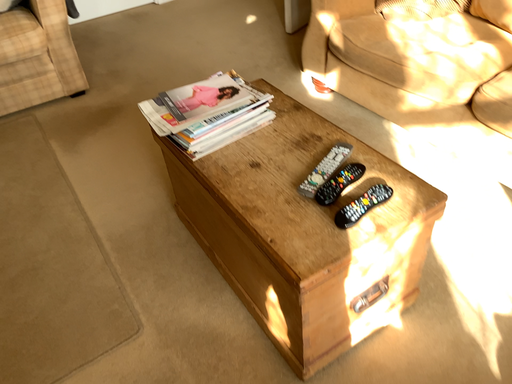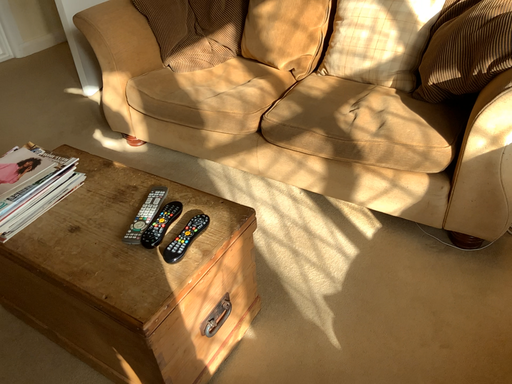
Question: Which way did the camera rotate in the video?

Choices:
 (A) rotated right
 (B) rotated left

Answer: (A)